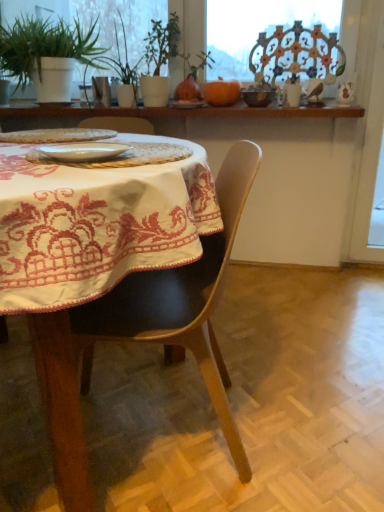
Question: In which direction should I rotate to look at matte brown bowl at upper center, which is the 1th tableware from back to front?

Choices:
 (A) right
 (B) left

Answer: (A)

Question: Does white embroidered tablecloth at center have a greater height compared to wooden shelf at upper center?

Choices:
 (A) yes
 (B) no

Answer: (A)

Question: Does white embroidered tablecloth at center come behind wooden shelf at upper center?

Choices:
 (A) yes
 (B) no

Answer: (B)

Question: Can you confirm if white embroidered tablecloth at center is shorter than wooden shelf at upper center?

Choices:
 (A) yes
 (B) no

Answer: (B)

Question: From a real-world perspective, is white embroidered tablecloth at center positioned under wooden shelf at upper center based on gravity?

Choices:
 (A) yes
 (B) no

Answer: (A)

Question: Is white embroidered tablecloth at center to the left of wooden shelf at upper center from the viewer's perspective?

Choices:
 (A) no
 (B) yes

Answer: (B)

Question: Are white embroidered tablecloth at center and wooden shelf at upper center beside each other?

Choices:
 (A) no
 (B) yes

Answer: (A)

Question: From the image's perspective, is white embroidered tablecloth at center beneath green matte plant at upper left?

Choices:
 (A) no
 (B) yes

Answer: (B)

Question: Can you confirm if white embroidered tablecloth at center is positioned to the left of green matte plant at upper left?

Choices:
 (A) no
 (B) yes

Answer: (A)

Question: Is white embroidered tablecloth at center not inside green matte plant at upper left?

Choices:
 (A) yes
 (B) no

Answer: (A)

Question: Is white embroidered tablecloth at center behind green matte plant at upper left?

Choices:
 (A) yes
 (B) no

Answer: (B)

Question: Is green matte plant at upper left at the back of white embroidered tablecloth at center?

Choices:
 (A) yes
 (B) no

Answer: (B)

Question: Does white embroidered tablecloth at center have a larger size compared to green matte plant at upper left?

Choices:
 (A) no
 (B) yes

Answer: (B)

Question: Does green leafy plant at upper center come behind white glossy plate at center, arranged as the second tableware when viewed from the back?

Choices:
 (A) no
 (B) yes

Answer: (B)